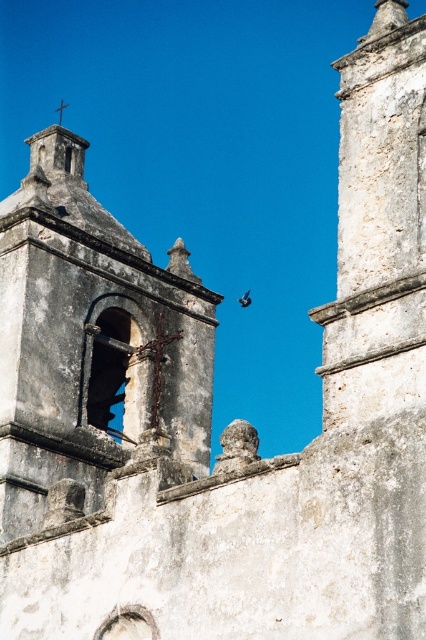
You are standing in front of a historic stone building. You see a point marked at coordinates (92, 344). According to the scene description, what object is located at that point?

The point at coordinates (92, 344) marks the white stone bell tower at upper left.

You are standing in front of a historic building and notice two white stone structures. One is the white stone bell tower at upper left and the other is the white stone tower at upper right. Based on their positions, which one is closer to the ground?

The white stone bell tower at upper left is closer to the ground because it is positioned below the white stone tower at upper right.